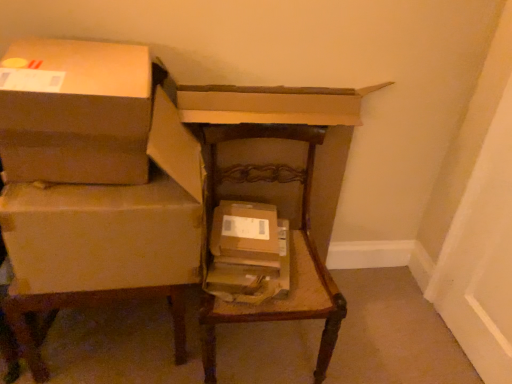
Question: From the image's perspective, is wooden chair at center, placed as the second furniture when sorted from left to right, under brown cardboard boxes at left, placed as the 2th furniture when sorted from right to left?

Choices:
 (A) yes
 (B) no

Answer: (A)

Question: Is brown cardboard boxes at left, placed as the 2th furniture when sorted from right to left, a part of wooden chair at center, the first furniture when ordered from right to left?

Choices:
 (A) yes
 (B) no

Answer: (B)

Question: Is wooden chair at center, the first furniture when ordered from right to left, touching brown cardboard boxes at left, placed as the 1th furniture when sorted from left to right?

Choices:
 (A) no
 (B) yes

Answer: (A)

Question: Can you confirm if wooden chair at center, the first furniture when ordered from right to left, is shorter than brown cardboard boxes at left, placed as the 2th furniture when sorted from right to left?

Choices:
 (A) yes
 (B) no

Answer: (A)

Question: Does wooden chair at center, placed as the second furniture when sorted from left to right, have a smaller size compared to brown cardboard boxes at left, placed as the 1th furniture when sorted from left to right?

Choices:
 (A) no
 (B) yes

Answer: (B)

Question: From a real-world perspective, is wooden chair at center, placed as the second furniture when sorted from left to right, beneath brown cardboard boxes at left, placed as the 2th furniture when sorted from right to left?

Choices:
 (A) no
 (B) yes

Answer: (B)

Question: Is brown cardboard boxes at left, placed as the 1th furniture when sorted from left to right, oriented towards wooden chair at center, the first furniture when ordered from right to left?

Choices:
 (A) no
 (B) yes

Answer: (A)

Question: Considering the relative sizes of brown cardboard boxes at left, placed as the 1th furniture when sorted from left to right, and wooden chair at center, the first furniture when ordered from right to left, in the image provided, is brown cardboard boxes at left, placed as the 1th furniture when sorted from left to right, bigger than wooden chair at center, the first furniture when ordered from right to left,?

Choices:
 (A) no
 (B) yes

Answer: (B)

Question: Is brown cardboard boxes at left, placed as the 2th furniture when sorted from right to left, closer to camera compared to wooden chair at center, the first furniture when ordered from right to left?

Choices:
 (A) no
 (B) yes

Answer: (B)

Question: Can you confirm if brown cardboard boxes at left, placed as the 1th furniture when sorted from left to right, is shorter than wooden chair at center, placed as the second furniture when sorted from left to right?

Choices:
 (A) no
 (B) yes

Answer: (A)

Question: Does brown cardboard boxes at left, placed as the 2th furniture when sorted from right to left, have a greater width compared to wooden chair at center, placed as the second furniture when sorted from left to right?

Choices:
 (A) no
 (B) yes

Answer: (A)

Question: Is brown cardboard boxes at left, placed as the 2th furniture when sorted from right to left, positioned beyond the bounds of wooden chair at center, placed as the second furniture when sorted from left to right?

Choices:
 (A) yes
 (B) no

Answer: (A)

Question: Can you confirm if brown cardboard box at left, positioned as the second box in right-to-left order, is smaller than brown cardboard box at center, which ranks as the 1th box in right-to-left order?

Choices:
 (A) no
 (B) yes

Answer: (A)